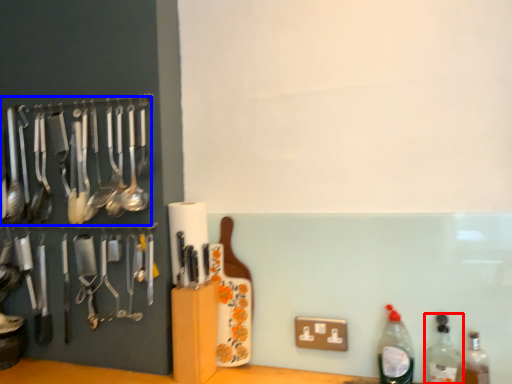
Question: Which point is further to the camera, bottle (highlighted by a red box) or spoon (highlighted by a blue box)?

Choices:
 (A) bottle
 (B) spoon

Answer: (B)